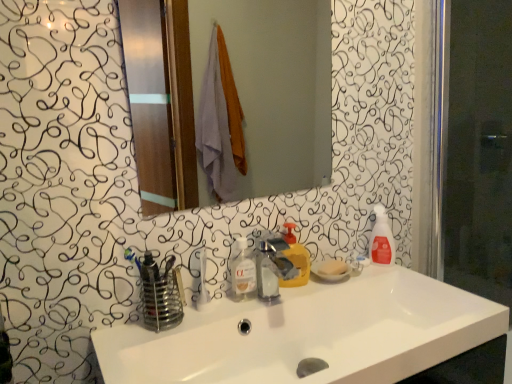
Question: Is translucent plastic spray bottle at right, arranged as the second cleaning product when viewed from the front, in front of or behind white glossy mirror at upper center in the image?

Choices:
 (A) front
 (B) behind

Answer: (B)

Question: Considering the positions of translucent plastic spray bottle at right, the first cleaning product in the back-to-front sequence, and white glossy mirror at upper center in the image, is translucent plastic spray bottle at right, the first cleaning product in the back-to-front sequence, taller or shorter than white glossy mirror at upper center?

Choices:
 (A) tall
 (B) short

Answer: (B)

Question: Which of these objects is positioned farthest from the translucent plastic spray bottle at right, acting as the 1th cleaning product starting from the right?

Choices:
 (A) yellow liquid soap at center, the 2th cleaning product when ordered from back to front
 (B) transparent glass screen door at right
 (C) metallic silver faucet at center
 (D) white glossy mirror at upper center
 (E) clear liquid soap at center

Answer: (D)

Question: Based on their relative distances, which object is nearer to the translucent plastic spray bottle at right, acting as the 1th cleaning product starting from the right?

Choices:
 (A) transparent glass screen door at right
 (B) white glossy sink at center
 (C) yellow liquid soap at center, positioned as the second cleaning product in right-to-left order
 (D) clear liquid soap at center
 (E) white glossy mirror at upper center

Answer: (C)